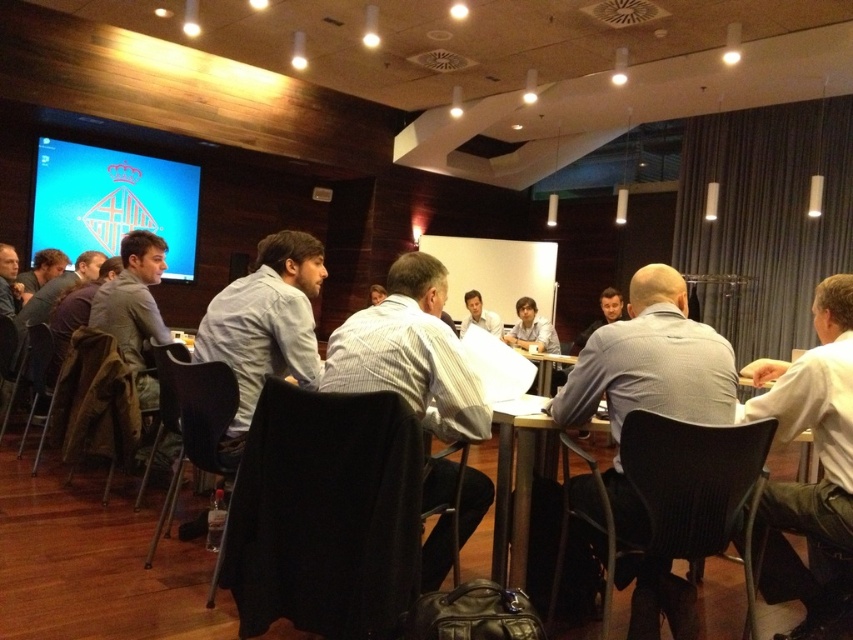
You are a service robot in a conference room. You need to deliver a document to the person wearing the gray shirt at left and the matte black shirt at center. The robot has a maximum delivery range of 3 meters. Can you deliver the documents to both recipients without moving the robot?

The distance between the gray shirt at left and the matte black shirt at center is 3.46 meters. Since the robot can only deliver up to 3 meters, it cannot reach both recipients without moving. The robot must move closer to either the gray shirt at left or the matte black shirt at center to deliver the documents.

You are a photographer positioned at the entrance of the conference room. You need to capture a photo that includes both the gray shirt at left and the matte black shirt at center. Which shirt should you focus on first to ensure both are in clear focus?

The gray shirt at left is closer to the viewer than the matte black shirt at center. To ensure both are in clear focus, focus on the gray shirt at left first since it is closer, and the matte black shirt at center will be within the depth of field.

You are a photographer in the conference room and want to capture a photo of the white striped shirt at center and the white shirt at center. Which one is positioned lower in the image?

The white striped shirt at center is located below the white shirt at center, so it is positioned lower in the image.